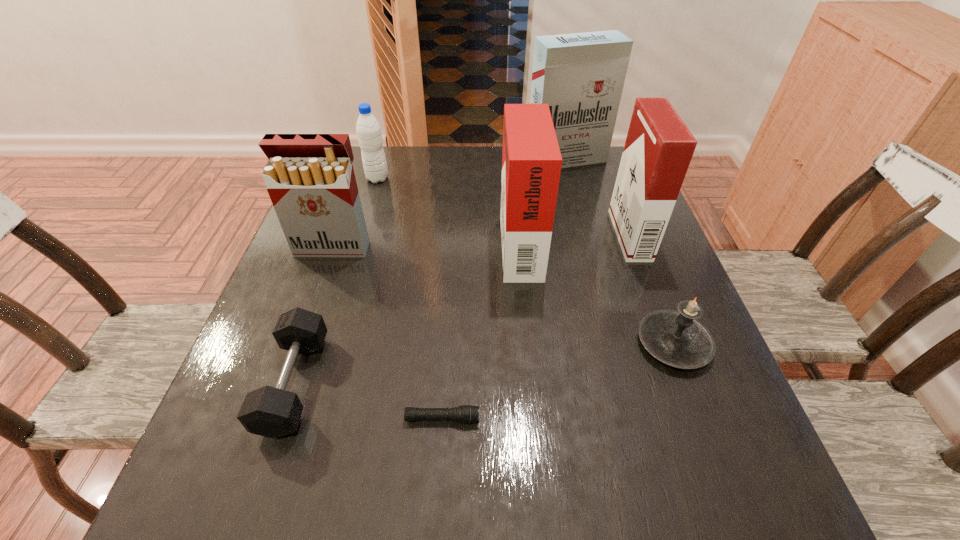
At what (x,y) coordinates should I click in order to perform the action: click on the farthest object. Please return your answer as a coordinate pair (x, y). The height and width of the screenshot is (540, 960). Looking at the image, I should click on (581, 76).

You are a GUI agent. You are given a task and a screenshot of the screen. Output one action in this format:
    pyautogui.click(x=<x>, y=<y>)
    Task: Click on the leftmost cigarette case
    The height and width of the screenshot is (540, 960).
    Given the screenshot: What is the action you would take?
    pyautogui.click(x=310, y=179)

I want to click on water bottle, so click(368, 129).

Find the location of a particular element. This screenshot has height=540, width=960. the fifth tallest object is located at coordinates (368, 129).

This screenshot has height=540, width=960. In order to click on the sixth tallest object in this screenshot , I will do `click(676, 338)`.

I want to click on the seventh tallest object, so click(x=273, y=412).

I want to click on the shortest object, so click(x=466, y=414).

I want to click on flashlight, so click(466, 414).

The height and width of the screenshot is (540, 960). I want to click on vacant space located on the left of the farthest cigarette case, so tap(442, 159).

You are a GUI agent. You are given a task and a screenshot of the screen. Output one action in this format:
    pyautogui.click(x=<x>, y=<y>)
    Task: Click on the free space located with the lid open on the leftmost cigarette case
    The height and width of the screenshot is (540, 960).
    Given the screenshot: What is the action you would take?
    pyautogui.click(x=276, y=406)